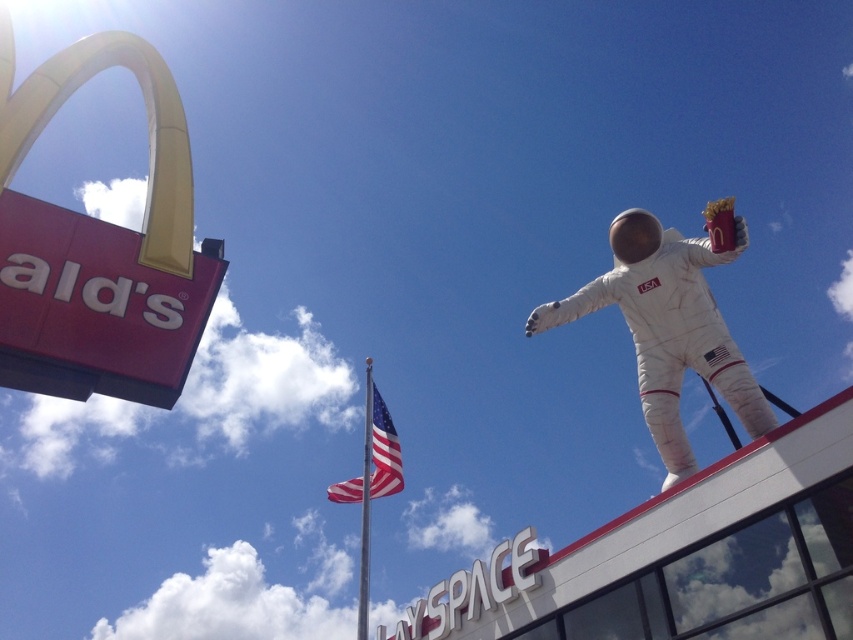
From the picture: Does white fabric astronaut at upper right have a smaller size compared to american flag at center?

Actually, white fabric astronaut at upper right might be larger than american flag at center.

Image resolution: width=853 pixels, height=640 pixels. I want to click on white fabric astronaut at upper right, so click(x=668, y=328).

Between point (624, 285) and point (386, 468), which one is positioned behind?

Point (386, 468)

The width and height of the screenshot is (853, 640). In order to click on white fabric astronaut at upper right in this screenshot , I will do `click(668, 328)`.